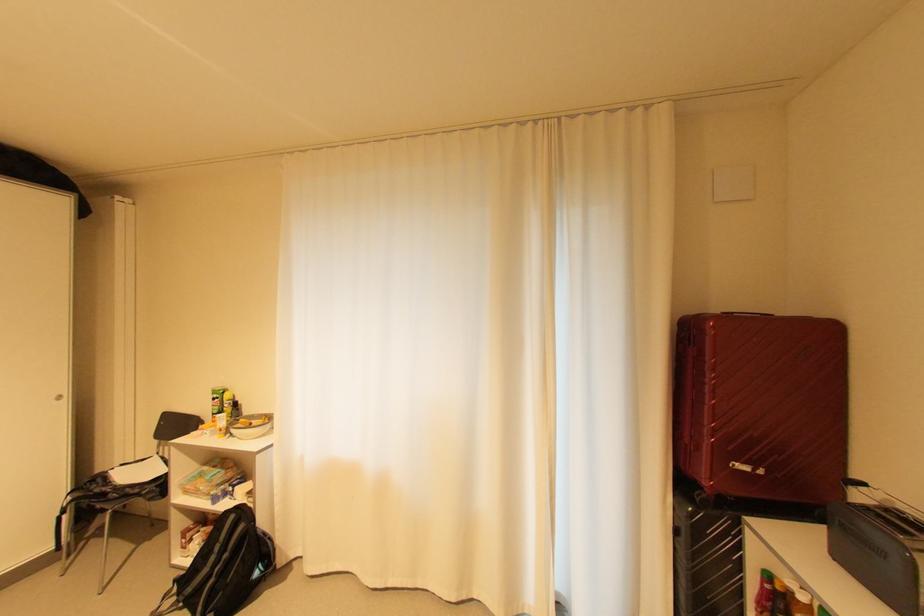
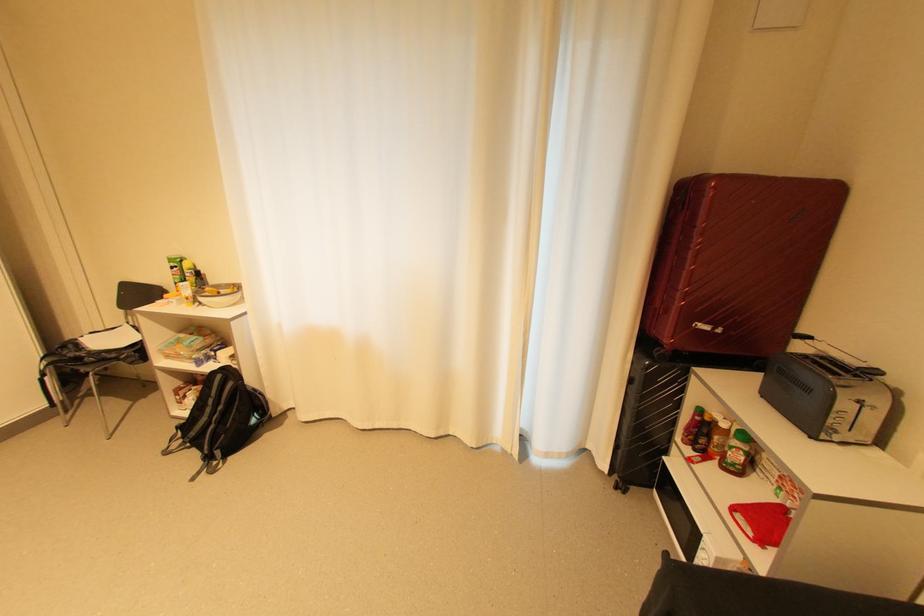
In the second image, find the point that corresponds to the point at 685,532 in the first image.

(638, 381)